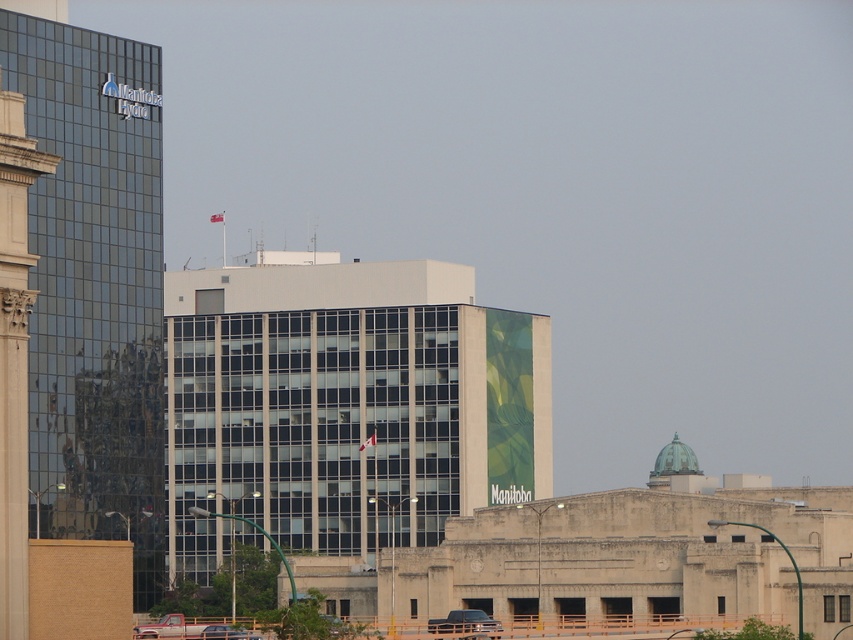
You are standing at the point marked by the coordinates point (93, 284) in the cityscape. Which building are you facing? Please choose from the glassy reflective building at left and the traditional beige building in the center.

The point (93, 284) marks the glassy reflective building at left, so you are facing that building.

You are a delivery person standing next to the metallic silver car at center. You need to deliver a package to the glassy reflective building at left. The delivery robot you have can carry the package but has a maximum range of 15 meters. Can the robot make the delivery without needing a recharge?

The glassy reflective building at left is 16.54 meters from the metallic silver car at center. Since the robot can only travel 15 meters before needing a recharge, it cannot make the delivery without recharging.